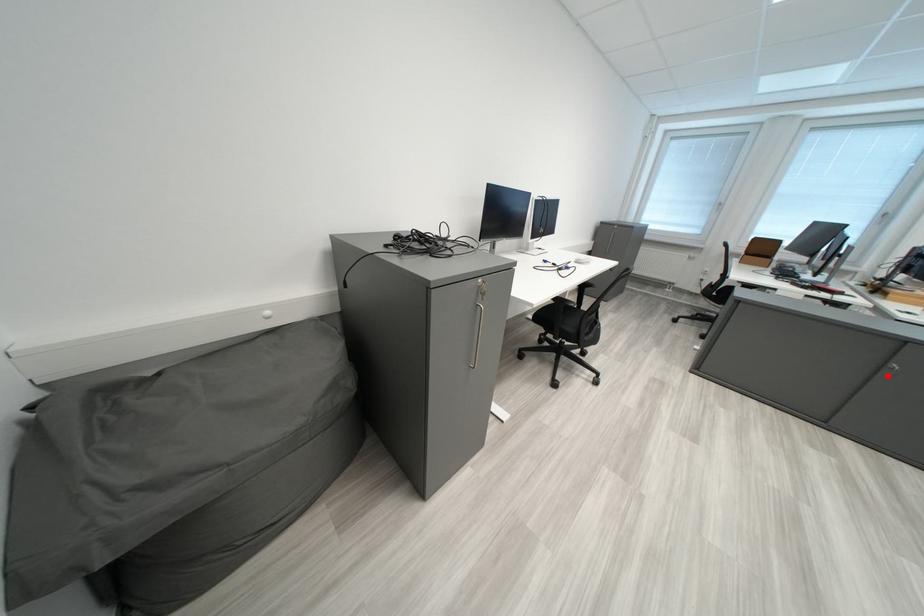
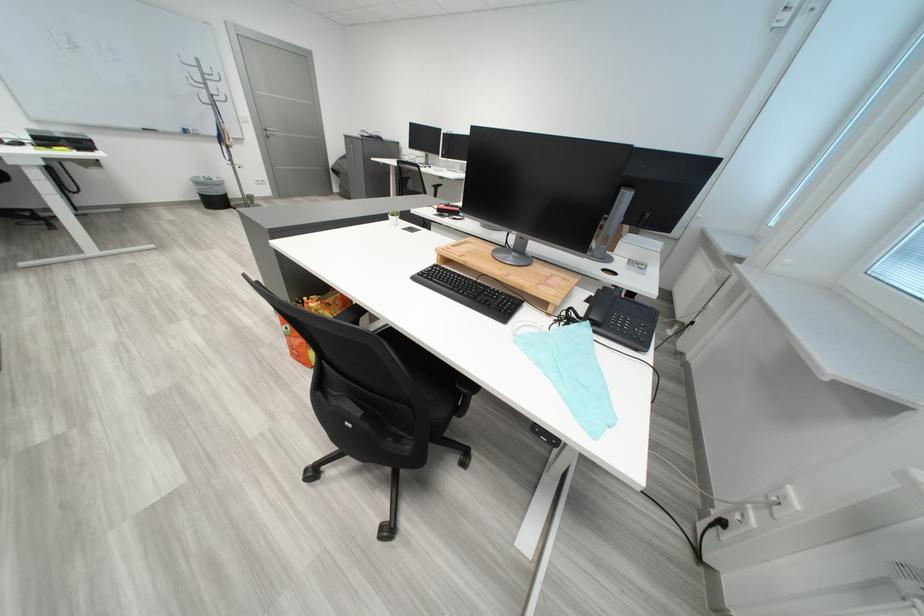
Question: I am providing you with two images of the same scene from different viewpoints. A red point is marked on the first image. At the location where the point appears in image 1, is it still visible in image 2?

Choices:
 (A) Yes
 (B) No

Answer: (B)